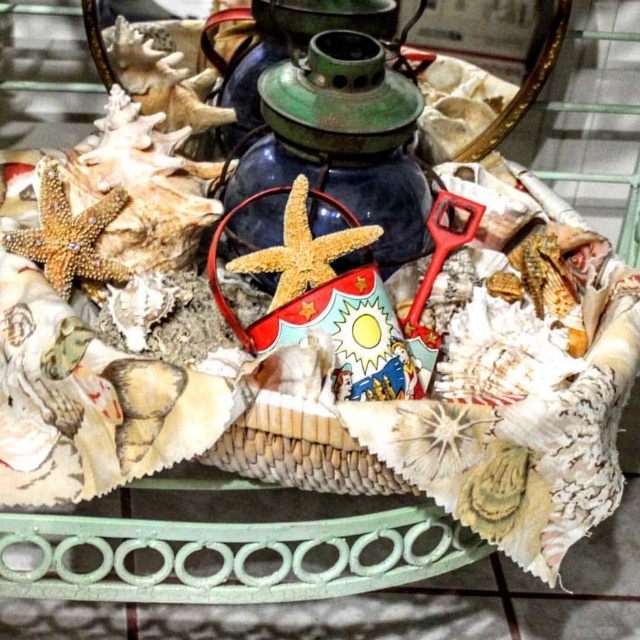
Question: Is matte wicker basket at center above green matte lamp at center?

Choices:
 (A) yes
 (B) no

Answer: (B)

Question: Is matte wicker basket at center to the right of green matte lamp at center from the viewer's perspective?

Choices:
 (A) no
 (B) yes

Answer: (A)

Question: Which point is farther from the camera taking this photo?

Choices:
 (A) (314, 202)
 (B) (275, 262)

Answer: (A)

Question: Which of the following is the farthest from the observer?

Choices:
 (A) (310, 54)
 (B) (317, 264)

Answer: (A)

Question: Can you confirm if matte wicker basket at center is bigger than green matte lamp at center?

Choices:
 (A) yes
 (B) no

Answer: (A)

Question: Which point is farther to the camera?

Choices:
 (A) (273, 209)
 (B) (394, 349)

Answer: (A)